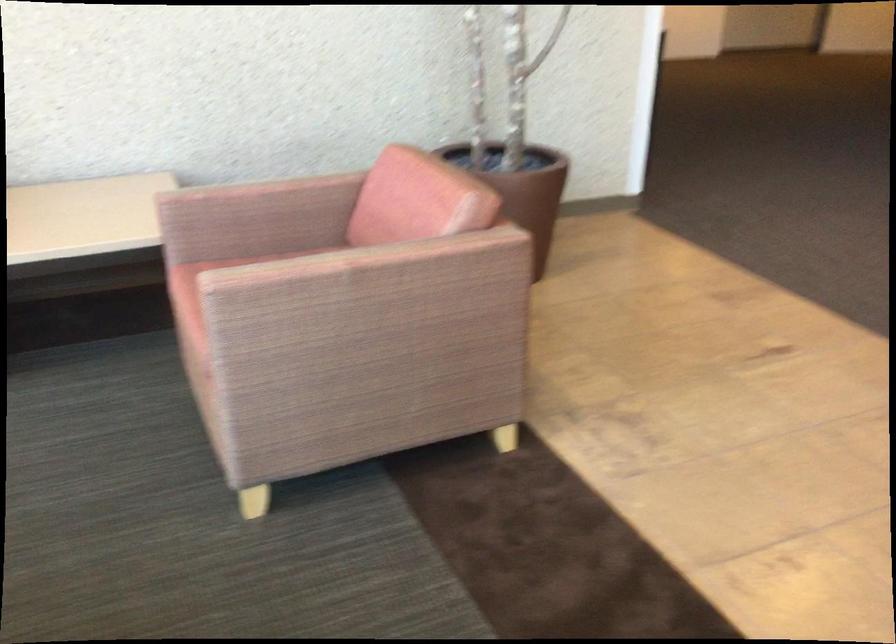
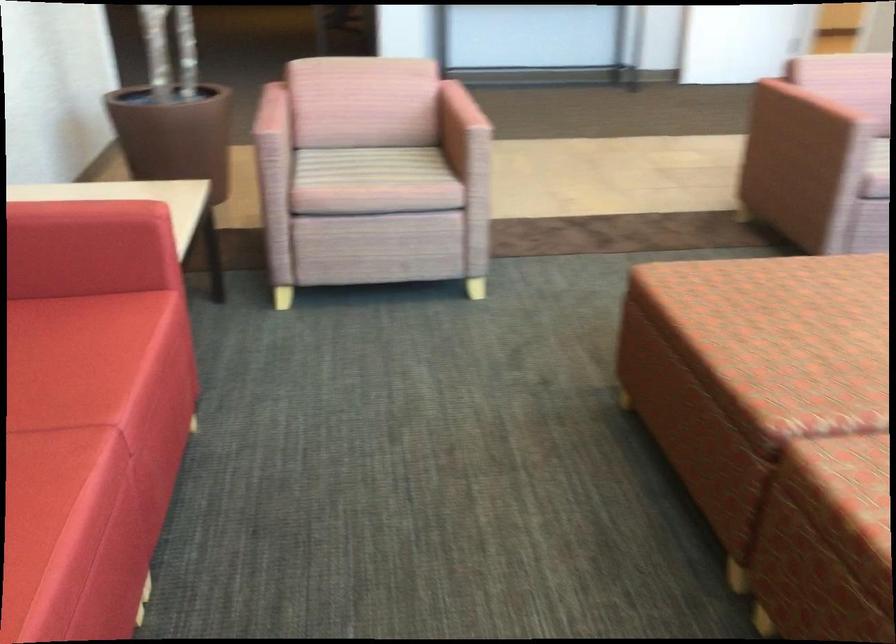
Locate, in the second image, the point that corresponds to (x=261, y=272) in the first image.

(459, 118)